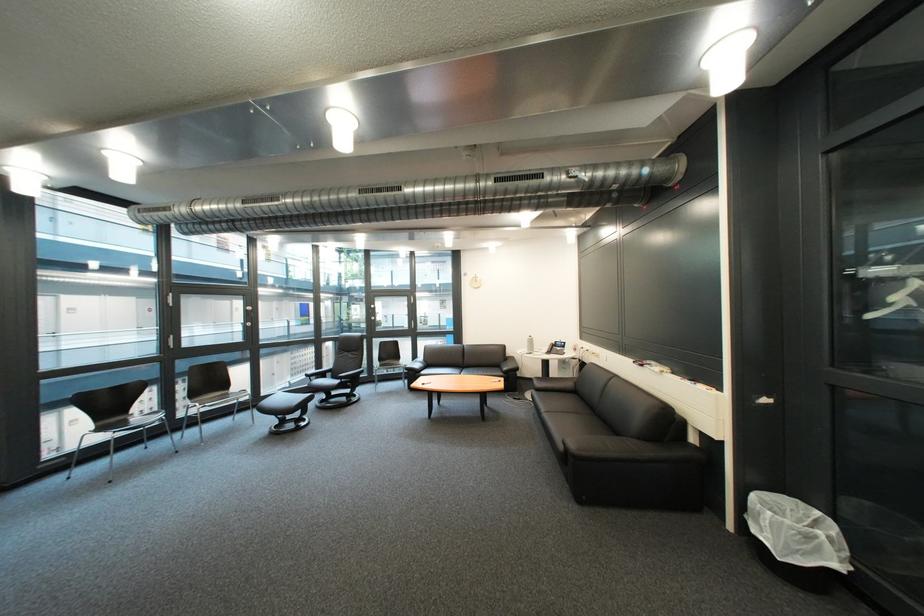
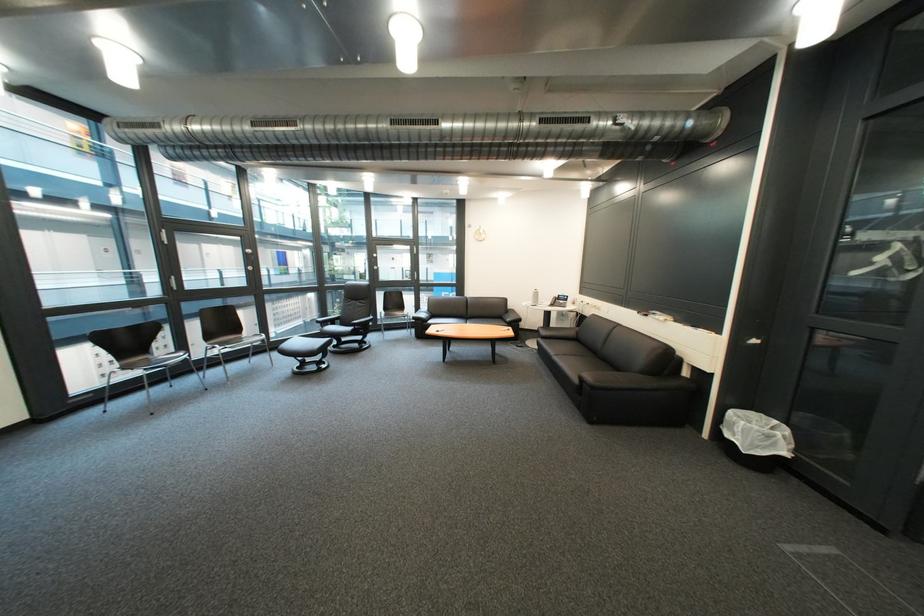
The point at [707,440] is marked in the first image. Where is the corresponding point in the second image?

(699, 375)